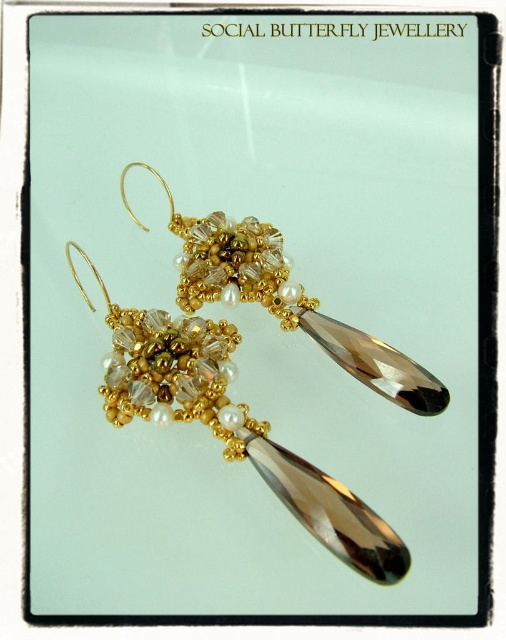
You are a jeweler examining the earrings. You need to determine if the smoky quartz teardrop at center can fit through a ring that has the same width as the gold beaded cluster at center. Can it pass through?

The smoky quartz teardrop at center has a width that is less than the gold beaded cluster at center, so it can pass through the ring with the same width as the gold beaded cluster at center.

Based on the photo, you are a jewelry designer examining the earrings from Social Butterfly Jewellery. You notice the smoky quartz teardrop at center and the gold beaded cluster at center. Which part of the earring is located below the other?

The smoky quartz teardrop at center is positioned under the gold beaded cluster at center, so the smoky quartz teardrop at center is below the gold beaded cluster at center.

You are a jeweler examining the earrings. You need to locate the smoky quartz teardrop at center. Where exactly is it positioned on the earring?

The smoky quartz teardrop at center is positioned at coordinates point (232, 426).